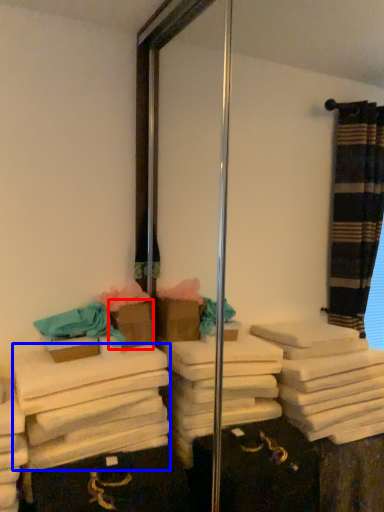
Question: Which object appears closest to the camera in this image, box (highlighted by a red box) or bath towel (highlighted by a blue box)?

Choices:
 (A) box
 (B) bath towel

Answer: (B)